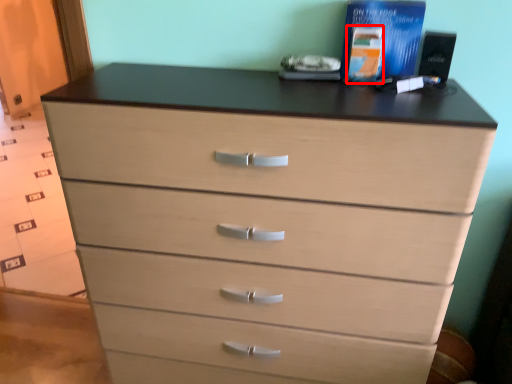
Question: From the image, what is the correct spatial relationship of book (annotated by the red box) in relation to book?

Choices:
 (A) right
 (B) left

Answer: (B)